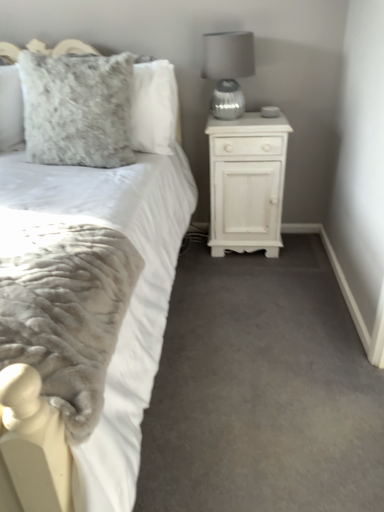
Question: Based on their sizes in the image, would you say fuzzy gray pillow at upper left is bigger or smaller than satin silver lamp at upper right?

Choices:
 (A) small
 (B) big

Answer: (B)

Question: Is fuzzy gray pillow at upper left inside or outside of satin silver lamp at upper right?

Choices:
 (A) inside
 (B) outside

Answer: (B)

Question: Estimate the real-world distances between objects in this image. Which object is closer to the satin silver lamp at upper right?

Choices:
 (A) white plush bed at center
 (B) fuzzy gray pillow at upper left
 (C) white wood nightstand at right

Answer: (C)

Question: Estimate the real-world distances between objects in this image. Which object is farther from the white wood nightstand at right?

Choices:
 (A) white plush bed at center
 (B) fuzzy gray pillow at upper left
 (C) satin silver lamp at upper right

Answer: (A)